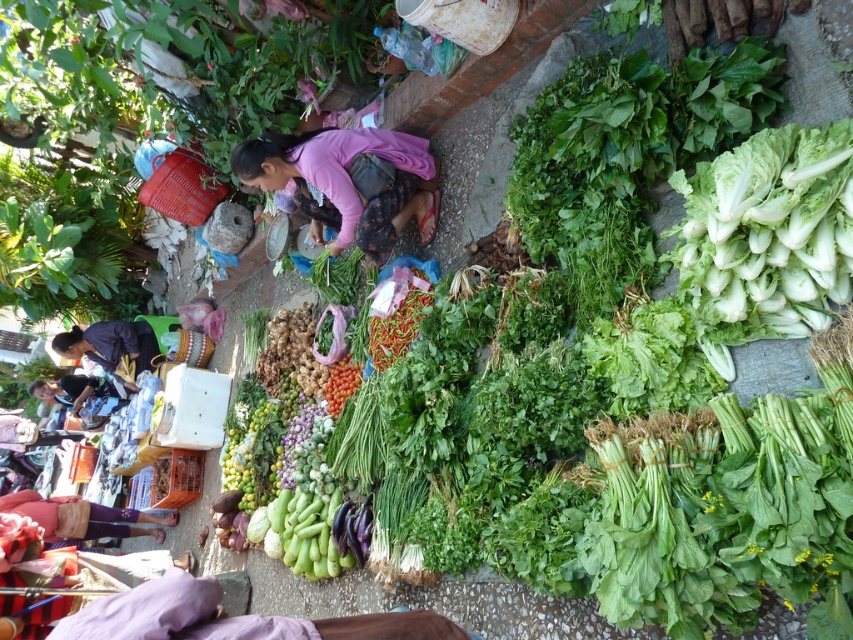
Question: Does dark blue fabric at lower left have a smaller size compared to matte black jacket at lower left?

Choices:
 (A) yes
 (B) no

Answer: (A)

Question: In this image, where is pink fabric at center located relative to dark blue fabric at lower left?

Choices:
 (A) above
 (B) below

Answer: (A)

Question: Is pink fabric pants at lower left thinner than dark blue fabric at lower left?

Choices:
 (A) yes
 (B) no

Answer: (A)

Question: Estimate the real-world distances between objects in this image. Which object is closer to the pink fabric at center?

Choices:
 (A) matte black jacket at lower left
 (B) pink fabric pants at lower left
 (C) dark blue fabric at lower left

Answer: (B)

Question: Which point is farther to the camera?

Choices:
 (A) (53, 400)
 (B) (294, 141)

Answer: (A)

Question: Which point is closer to the camera?

Choices:
 (A) pink fabric at center
 (B) dark blue fabric at lower left
 (C) pink fabric pants at lower left
 (D) matte black jacket at lower left

Answer: (A)